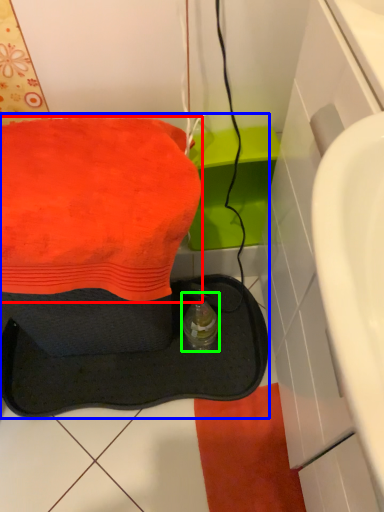
Question: Estimate the real-world distances between objects in this image. Which object is closer to towel (highlighted by a red box), sink (highlighted by a blue box) or bottle (highlighted by a green box)?

Choices:
 (A) sink
 (B) bottle

Answer: (B)